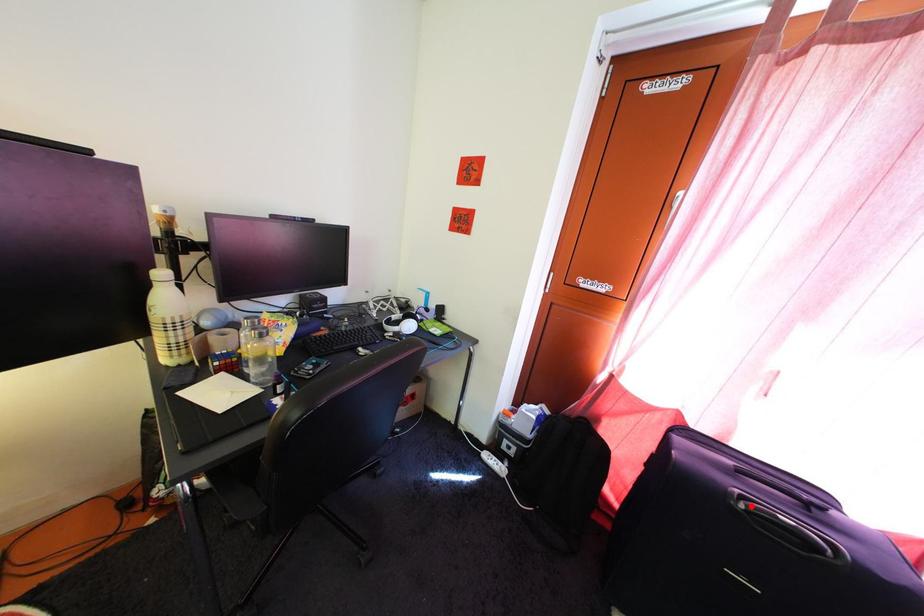
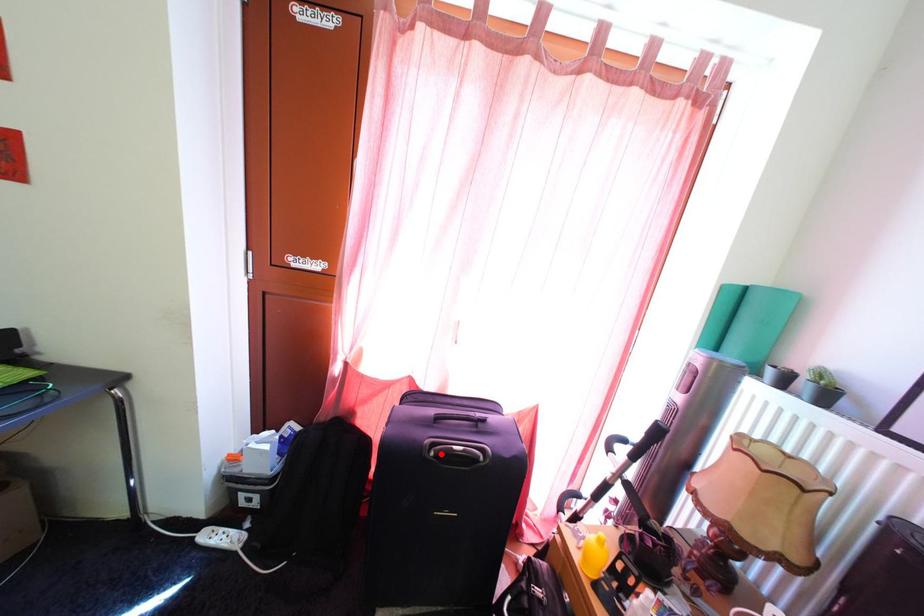
I am providing you with two images of the same scene from different viewpoints. A red point is marked on the first image and another point is marked on the second image. Are the points marked in image1 and image2 representing the same 3D position?

Yes